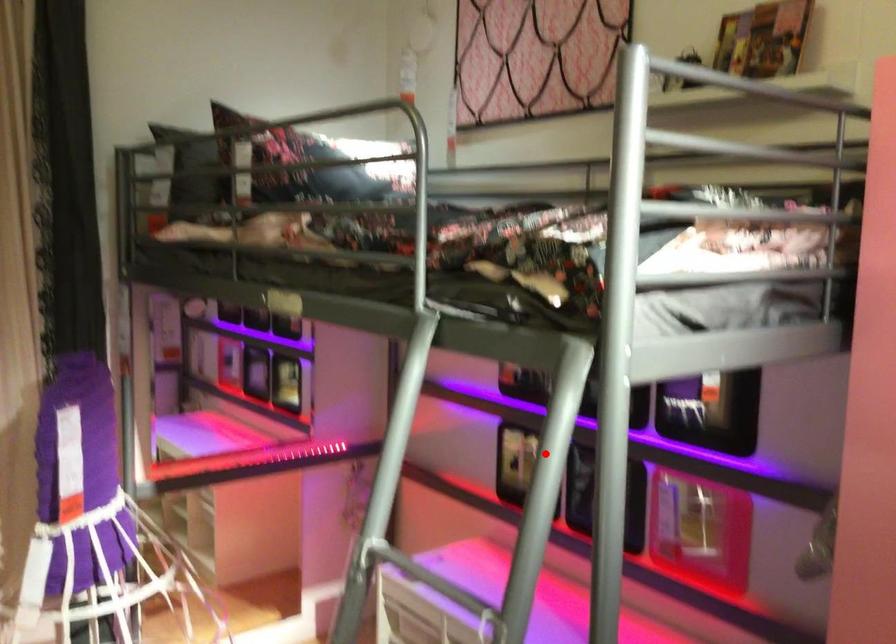
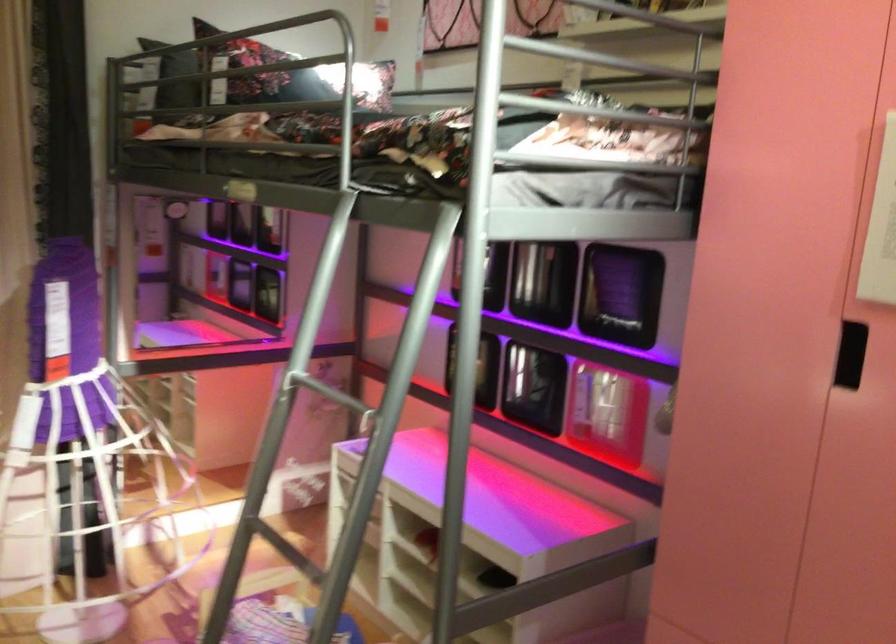
The point at the highlighted location is marked in the first image. Where is the corresponding point in the second image?

(420, 292)